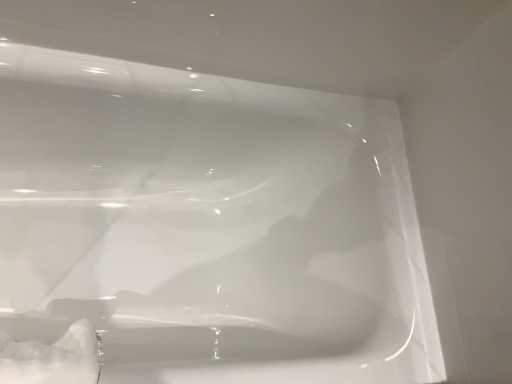
What is the approximate height of white textured foam at lower left?

9.10 inches.

Where is `white textured foam at lower left`? white textured foam at lower left is located at coordinates (51, 358).

What do you see at coordinates (51, 358) in the screenshot? I see `white textured foam at lower left` at bounding box center [51, 358].

Locate an element on the screen. Image resolution: width=512 pixels, height=384 pixels. white textured foam at lower left is located at coordinates click(51, 358).